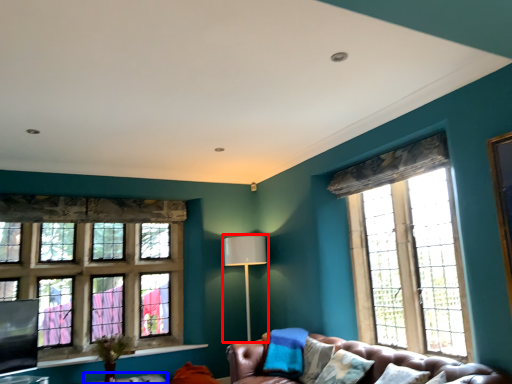
Question: Which object appears farthest to the camera in this image, lamp (highlighted by a red box) or table (highlighted by a blue box)?

Choices:
 (A) lamp
 (B) table

Answer: (A)